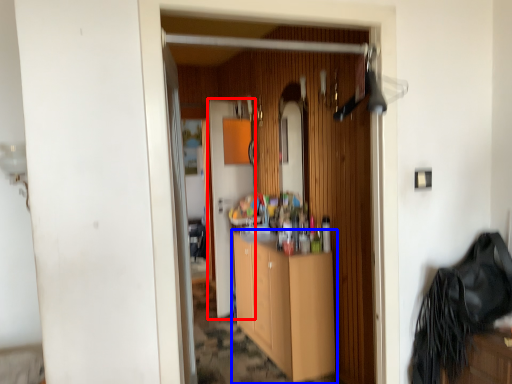
Question: Among these objects, which one is nearest to the camera, door (highlighted by a red box) or cabinetry (highlighted by a blue box)?

Choices:
 (A) door
 (B) cabinetry

Answer: (B)